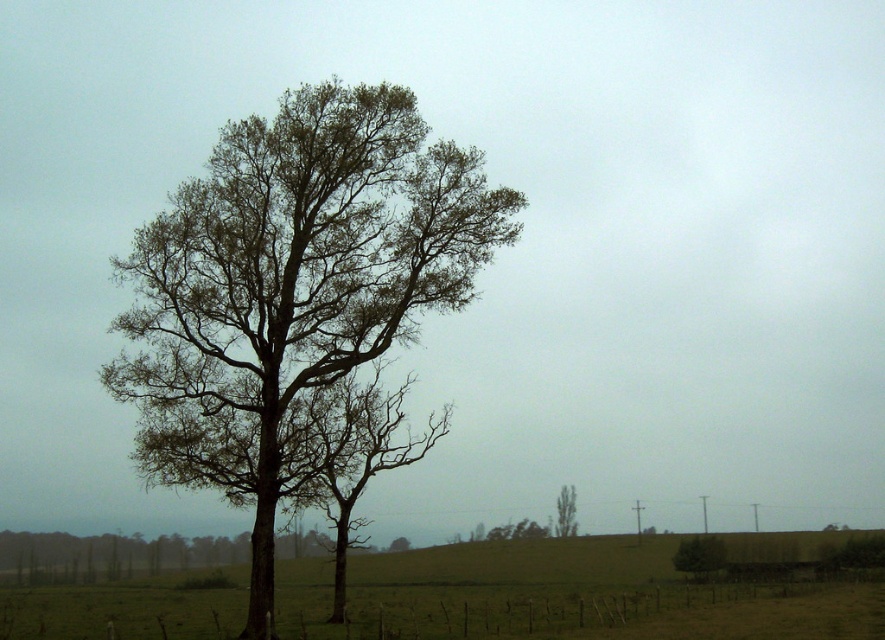
You are standing in the rural landscape shown. You see a point marked at coordinates [589,589]. What is located at that point?

The point at coordinates [589,589] is where the green grass at center is located.

You are standing in the rural landscape shown in the image. You notice a point marked at coordinates (699, 556). What object does this point correspond to?

The point at coordinates (699, 556) corresponds to the green leafy tree at lower right.